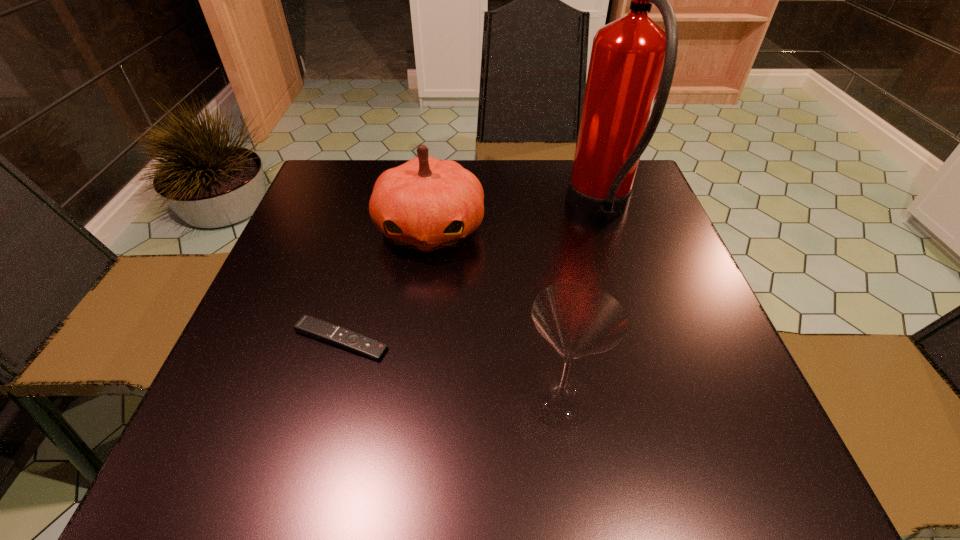
The height and width of the screenshot is (540, 960). Identify the location of vacant space located on the right of the remote control. (488, 340).

Where is `fire extinguisher that is at the far edge`? Image resolution: width=960 pixels, height=540 pixels. fire extinguisher that is at the far edge is located at coordinates (633, 59).

You are a GUI agent. You are given a task and a screenshot of the screen. Output one action in this format:
    pyautogui.click(x=<x>, y=<y>)
    Task: Click on the pumpkin positioned at the far edge
    Image resolution: width=960 pixels, height=540 pixels.
    Given the screenshot: What is the action you would take?
    pyautogui.click(x=426, y=204)

I want to click on object situated at the near edge, so click(x=578, y=319).

This screenshot has height=540, width=960. Find the location of `object that is at the left edge`. object that is at the left edge is located at coordinates (316, 328).

This screenshot has height=540, width=960. Identify the location of object located at the right edge. (633, 59).

Where is `object that is at the far right corner`? This screenshot has width=960, height=540. object that is at the far right corner is located at coordinates (633, 59).

Find the location of a particular element. The image size is (960, 540). vacant space at the near edge of the desktop is located at coordinates (651, 436).

The height and width of the screenshot is (540, 960). In the image, there is a desktop. Identify the location of blank space at the left edge. (329, 281).

Image resolution: width=960 pixels, height=540 pixels. In the image, there is a desktop. Find the location of `free space at the right edge`. free space at the right edge is located at coordinates (625, 217).